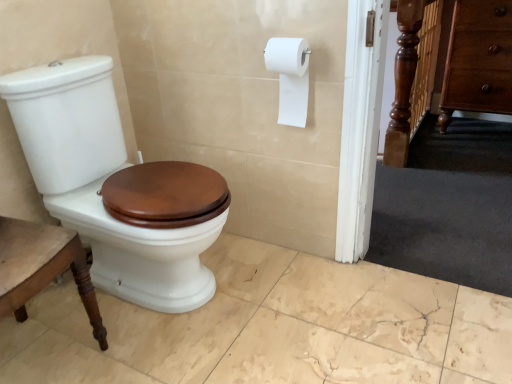
Question: From the image's perspective, is white matte toilet paper at upper right positioned above or below brown wood drawer at right?

Choices:
 (A) above
 (B) below

Answer: (B)

Question: Visually, is white matte toilet paper at upper right positioned to the left or to the right of brown wood drawer at right?

Choices:
 (A) right
 (B) left

Answer: (B)

Question: Which is farther from the brown wood drawer at right?

Choices:
 (A) white glossy toilet at left
 (B) white matte toilet paper at upper right

Answer: (A)

Question: Based on their relative distances, which object is farther from the brown wood drawer at right?

Choices:
 (A) white matte toilet paper at upper right
 (B) white glossy toilet at left

Answer: (B)